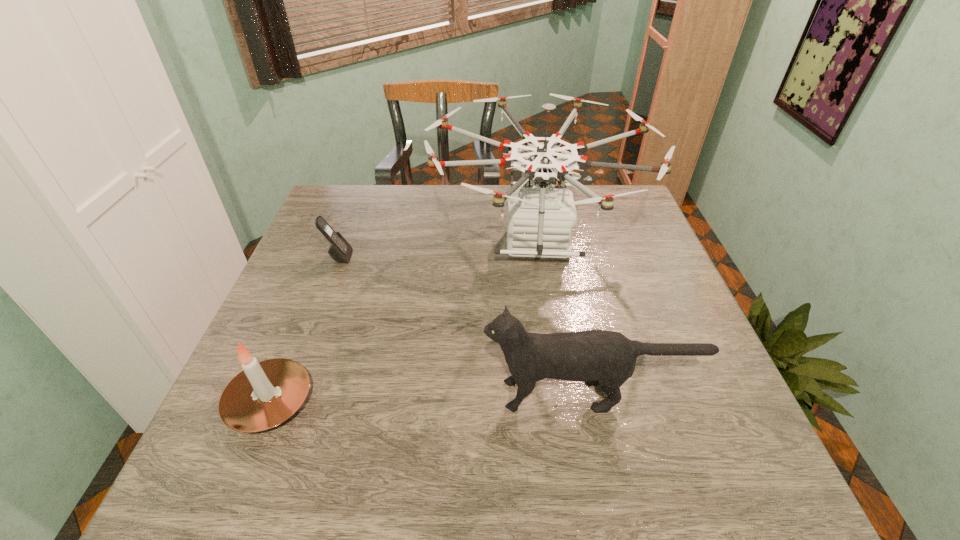
In the image, there is a desktop. Identify the location of free space at the far left corner. This screenshot has width=960, height=540. (349, 223).

This screenshot has height=540, width=960. I want to click on free space at the near left corner of the desktop, so click(250, 498).

The width and height of the screenshot is (960, 540). In the image, there is a desktop. In order to click on vacant space at the far right corner in this screenshot , I will do `click(612, 191)`.

The width and height of the screenshot is (960, 540). I want to click on empty space between the cellular telephone and the tallest object, so click(x=437, y=251).

The width and height of the screenshot is (960, 540). What are the coordinates of `empty space that is in between the candle and the drone` in the screenshot? It's located at (402, 323).

The width and height of the screenshot is (960, 540). Identify the location of free point between the drone and the candle. (402, 323).

The height and width of the screenshot is (540, 960). Find the location of `vacant area that lies between the candle and the drone`. vacant area that lies between the candle and the drone is located at coordinates (402, 323).

This screenshot has height=540, width=960. Identify the location of unoccupied area between the second tallest object and the cellular telephone. (464, 326).

Find the location of a particular element. This screenshot has width=960, height=540. free space that is in between the third shortest object and the cellular telephone is located at coordinates (464, 326).

This screenshot has width=960, height=540. I want to click on vacant area that lies between the shortest object and the tallest object, so click(x=437, y=251).